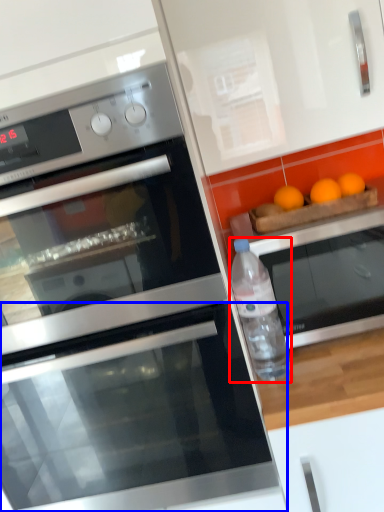
Question: Which of the following is the closest to the observer, bottle (highlighted by a red box) or oven (highlighted by a blue box)?

Choices:
 (A) bottle
 (B) oven

Answer: (B)